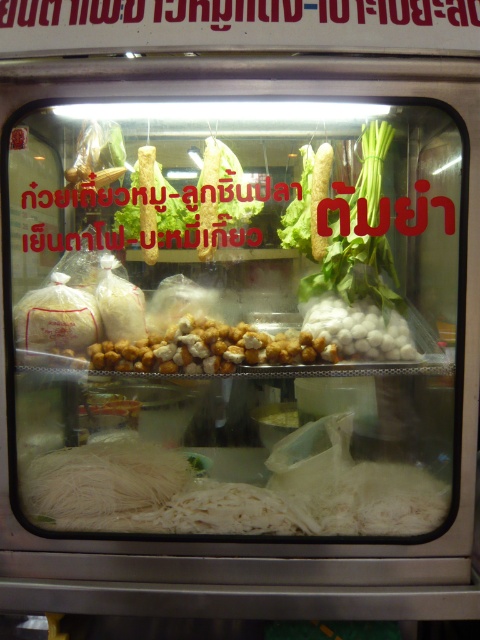
You are a food delivery robot with a 20 cm wide tray. You need to pick up both the golden crispy balls at center and the white glossy balls at center from the stall. Can your tray fit both items side by side without overlapping?

The distance between the golden crispy balls at center and the white glossy balls at center is 19.62 centimeters. Since your tray is 20 cm wide, there is enough space to place both items side by side without overlapping.

You are a customer at the food stall and want to grab both the green leafy vegetable at right and the white glossy balls at center. Which item should you reach for first to get the one that is nearer to you?

The green leafy vegetable at right is closer to the viewer than the white glossy balls at center, so you should reach for the green leafy vegetable at right first.